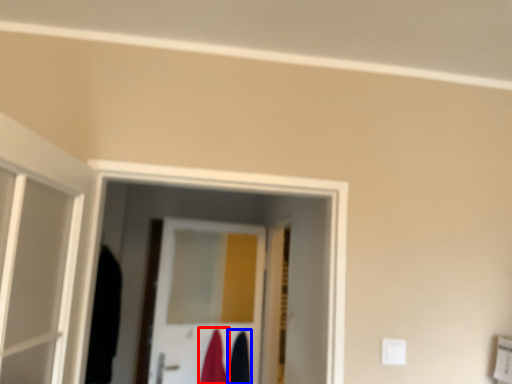
Question: Which of the following is the closest to the observer, robe (highlighted by a red box) or robe (highlighted by a blue box)?

Choices:
 (A) robe
 (B) robe

Answer: (A)